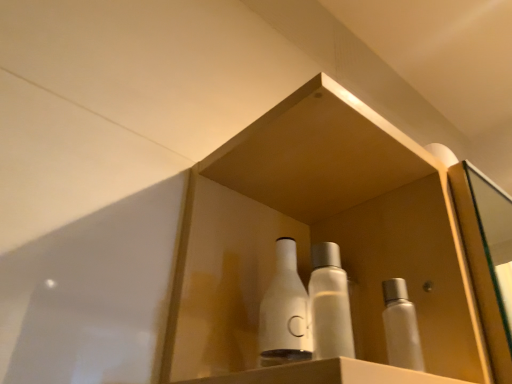
Question: Can you confirm if white matte bottle at right, which is the 3th bottle from left to right, is shorter than translucent plastic bottle at center, the second bottle viewed from the left?

Choices:
 (A) yes
 (B) no

Answer: (A)

Question: Is white matte bottle at right, which is the 3th bottle from left to right, next to translucent plastic bottle at center, the second bottle viewed from the left, and touching it?

Choices:
 (A) yes
 (B) no

Answer: (A)

Question: Is white matte bottle at right, which is the 3th bottle from left to right, turned away from translucent plastic bottle at center, the second bottle viewed from the left?

Choices:
 (A) yes
 (B) no

Answer: (A)

Question: Can you confirm if white matte bottle at right, which appears as the first bottle when viewed from the right, is bigger than translucent plastic bottle at center, the second bottle viewed from the left?

Choices:
 (A) no
 (B) yes

Answer: (B)

Question: Is white matte bottle at right, which appears as the first bottle when viewed from the right, facing towards translucent plastic bottle at center, the second bottle viewed from the left?

Choices:
 (A) yes
 (B) no

Answer: (B)

Question: In the image, is translucent plastic bottle at center, the second bottle viewed from the left, positioned in front of or behind white matte bottle at center, acting as the 1th bottle starting from the left?

Choices:
 (A) behind
 (B) front

Answer: (B)

Question: Which is correct: translucent plastic bottle at center, the second bottle viewed from the left, is inside white matte bottle at center, acting as the 1th bottle starting from the left, or outside of it?

Choices:
 (A) outside
 (B) inside

Answer: (A)

Question: From their relative heights in the image, would you say translucent plastic bottle at center, the second bottle positioned from the right, is taller or shorter than white matte bottle at center, acting as the 1th bottle starting from the left?

Choices:
 (A) short
 (B) tall

Answer: (A)

Question: In the image, is translucent plastic bottle at center, the second bottle positioned from the right, on the left side or the right side of white matte bottle at center, the third bottle positioned from the right?

Choices:
 (A) right
 (B) left

Answer: (A)

Question: Considering the positions of white matte bottle at right, which appears as the first bottle when viewed from the right, and translucent plastic bottle at center, the second bottle viewed from the left, in the image, is white matte bottle at right, which appears as the first bottle when viewed from the right, wider or thinner than translucent plastic bottle at center, the second bottle viewed from the left,?

Choices:
 (A) thin
 (B) wide

Answer: (B)

Question: From a real-world perspective, is white matte bottle at right, which is the 3th bottle from left to right, above or below translucent plastic bottle at center, the second bottle positioned from the right?

Choices:
 (A) above
 (B) below

Answer: (B)

Question: Does point (410, 362) appear closer or farther from the camera than point (311, 324)?

Choices:
 (A) closer
 (B) farther

Answer: (B)

Question: Do you think white matte bottle at right, which appears as the first bottle when viewed from the right, is within translucent plastic bottle at center, the second bottle positioned from the right, or outside of it?

Choices:
 (A) outside
 (B) inside

Answer: (A)

Question: Based on their positions, is white glossy bottles at center located to the left or right of translucent plastic bottle at center, the second bottle positioned from the right?

Choices:
 (A) left
 (B) right

Answer: (B)

Question: Choose the correct answer: Is white glossy bottles at center inside translucent plastic bottle at center, the second bottle positioned from the right, or outside it?

Choices:
 (A) inside
 (B) outside

Answer: (B)